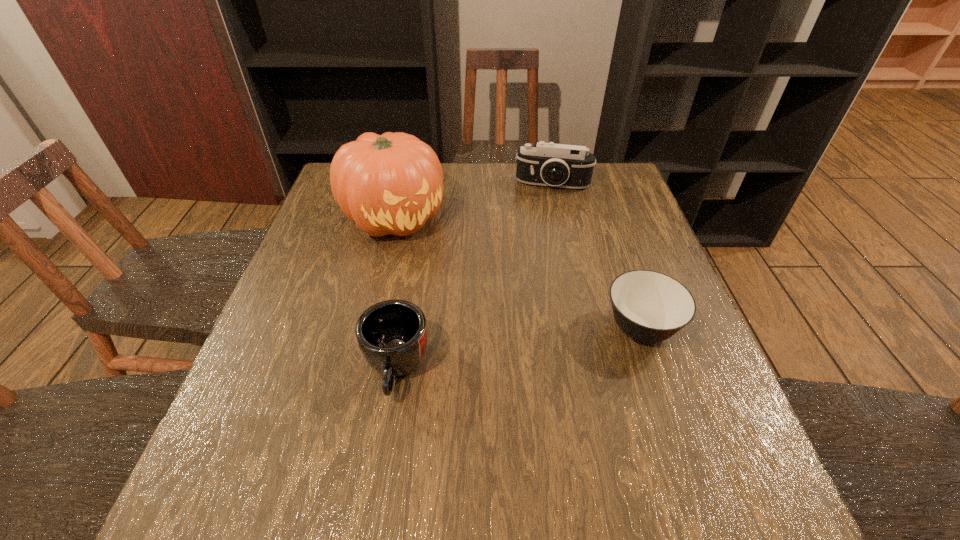
Image resolution: width=960 pixels, height=540 pixels. I want to click on vacant space on the desktop that is between the mug and the shortest object and is positioned on the front lens of the camera, so click(x=533, y=346).

Image resolution: width=960 pixels, height=540 pixels. Find the location of `free space on the desktop that is between the mug and the soup bowl and is positioned on the carved face of the tallest object`. free space on the desktop that is between the mug and the soup bowl and is positioned on the carved face of the tallest object is located at coordinates (525, 347).